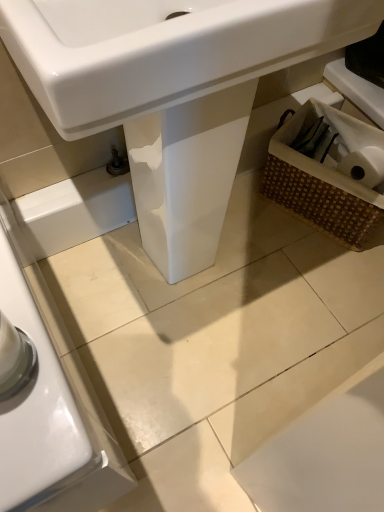
Where is `vacant area situated to the left side of woven brown basket at lower right`? vacant area situated to the left side of woven brown basket at lower right is located at coordinates (255, 216).